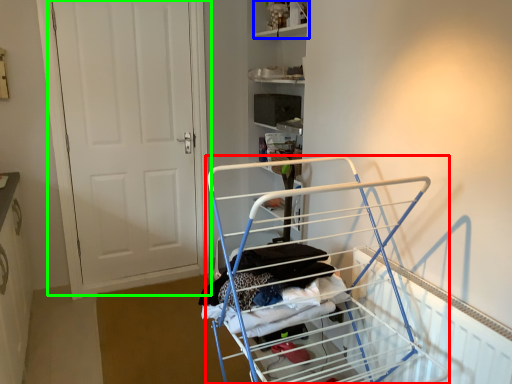
Question: Which object is the closest to the furniture (highlighted by a red box)? Choose among these: shelf (highlighted by a blue box) or door (highlighted by a green box).

Choices:
 (A) shelf
 (B) door

Answer: (B)